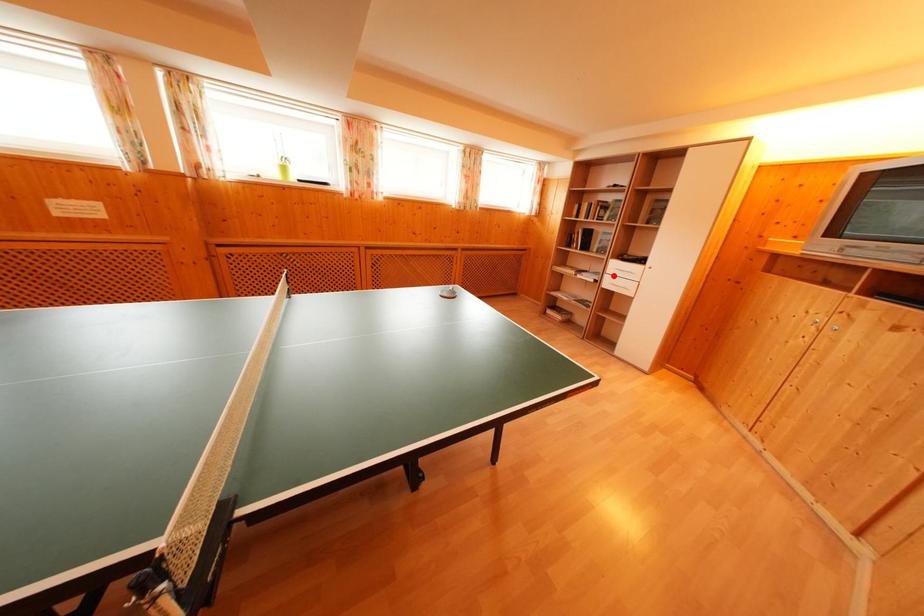
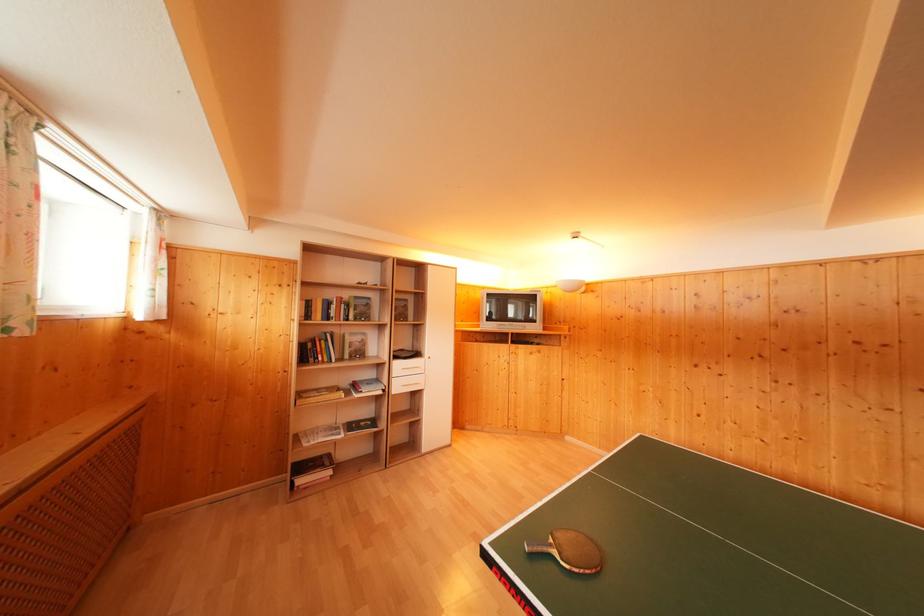
Question: I am providing you with two images of the same scene from different viewpoints. In image1, a red point is highlighted. Considering the same 3D point in image2, which of the following is correct?

Choices:
 (A) It is closer
 (B) It is farther

Answer: (B)